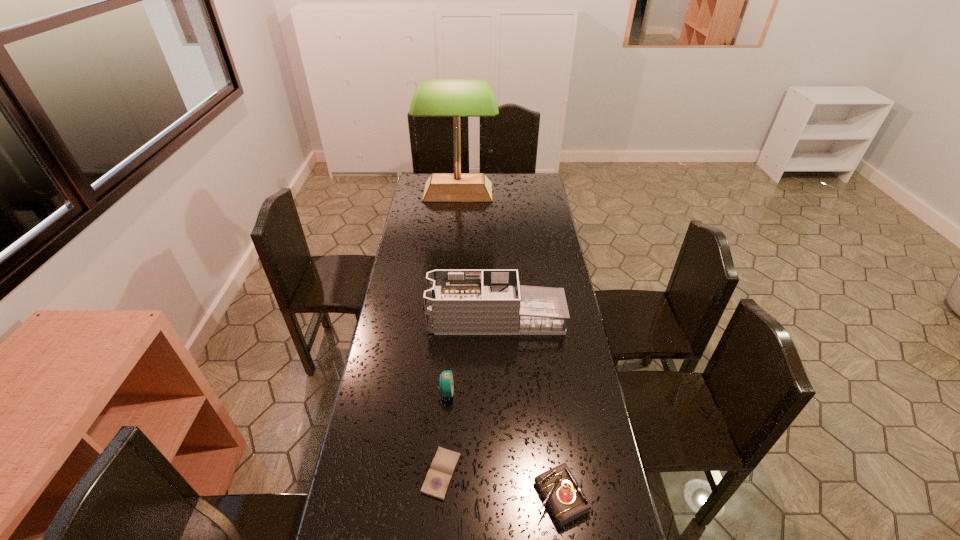
The image size is (960, 540). In order to click on blank space located 0.110m on the metallic stand of the tallest object in this screenshot , I will do `click(456, 220)`.

What are the coordinates of `free point located at the entrance of the dollhouse` in the screenshot? It's located at click(x=402, y=319).

Find the location of a particular element. vacant area situated 0.290m on the front-facing side of the third shortest object is located at coordinates (542, 392).

Locate an element on the screen. Image resolution: width=960 pixels, height=540 pixels. free region located on the back of the taller diary is located at coordinates (551, 421).

In order to click on vacant region located 0.060m on the left of the shorter diary in this screenshot , I will do `click(401, 474)`.

Locate an element on the screen. object situated at the far edge is located at coordinates (456, 98).

Locate an element on the screen. This screenshot has width=960, height=540. object at the left edge is located at coordinates (456, 98).

At what (x,y) coordinates should I click in order to perform the action: click on dollhouse positioned at the right edge. Please return your answer as a coordinate pair (x, y). This screenshot has width=960, height=540. Looking at the image, I should click on (457, 302).

I want to click on diary located in the right edge section of the desktop, so click(x=566, y=500).

Locate an element on the screen. object at the far left corner is located at coordinates (456, 98).